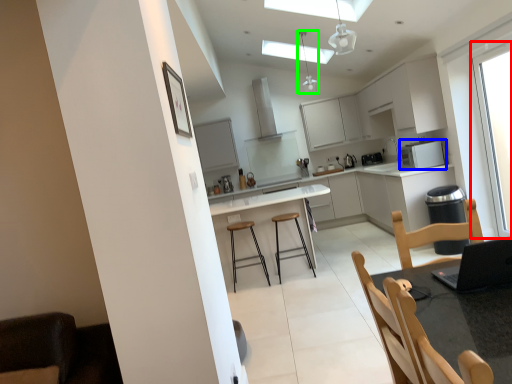
Question: Estimate the real-world distances between objects in this image. Which object is farther from window (highlighted by a red box), appliance (highlighted by a blue box) or light fixture (highlighted by a green box)?

Choices:
 (A) appliance
 (B) light fixture

Answer: (B)